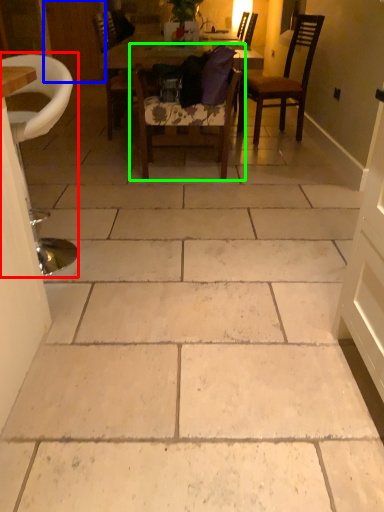
Question: Estimate the real-world distances between objects in this image. Which object is farther from chair (highlighted by a red box), door (highlighted by a blue box) or chair (highlighted by a green box)?

Choices:
 (A) door
 (B) chair

Answer: (A)